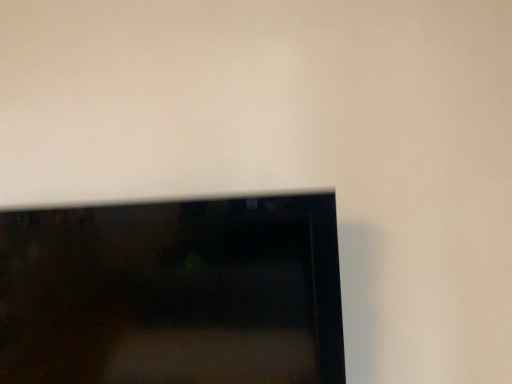
What is the approximate width of matte black tv at lower left?

26.72 centimeters.

At what (x,y) coordinates should I click in order to perform the action: click on matte black tv at lower left. Please return your answer as a coordinate pair (x, y). The image size is (512, 384). Looking at the image, I should click on (173, 293).

Describe the element at coordinates (173, 293) in the screenshot. I see `matte black tv at lower left` at that location.

Locate an element on the screen. This screenshot has width=512, height=384. matte black tv at lower left is located at coordinates (173, 293).